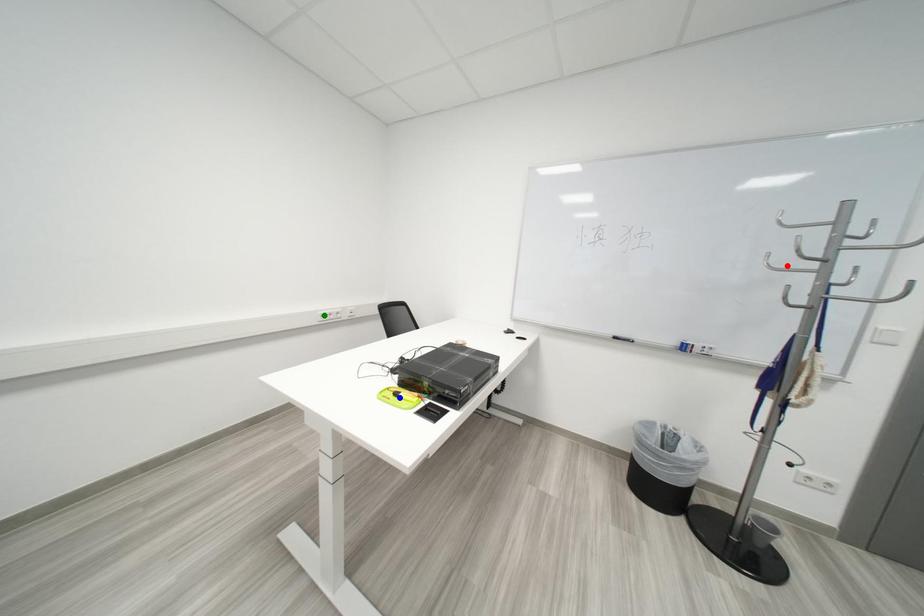
Order these from nearest to farthest:
- blue point
- green point
- red point

1. blue point
2. red point
3. green point